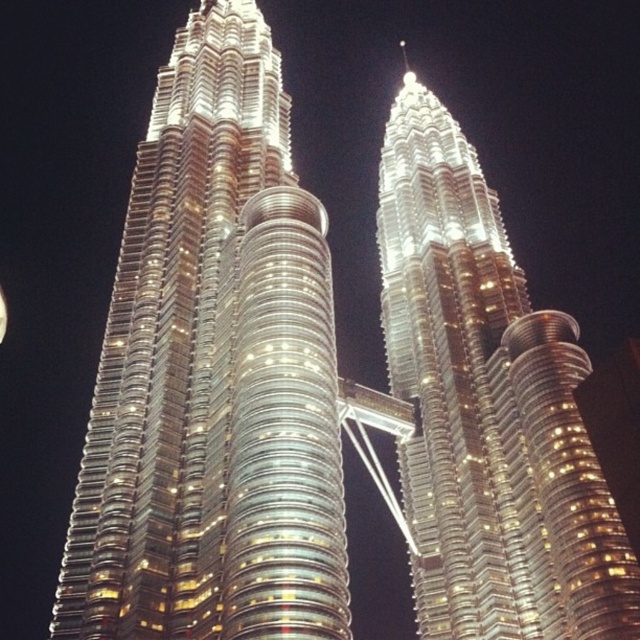
You are an architect analyzing the night view of the Petronas Twin Towers. You notice the shiny metallic twin towers at center and the bright silver moon at upper left. Which object has a smaller width?

The shiny metallic twin towers at center has a smaller width than the bright silver moon at upper left according to the description.